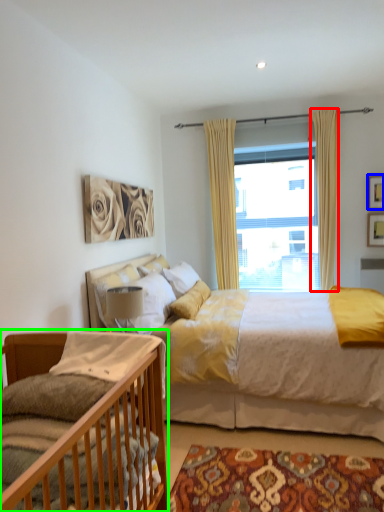
Question: Considering the real-world distances, which object is closest to curtain (highlighted by a red box)? picture frame (highlighted by a blue box) or bed (highlighted by a green box).

Choices:
 (A) picture frame
 (B) bed

Answer: (A)